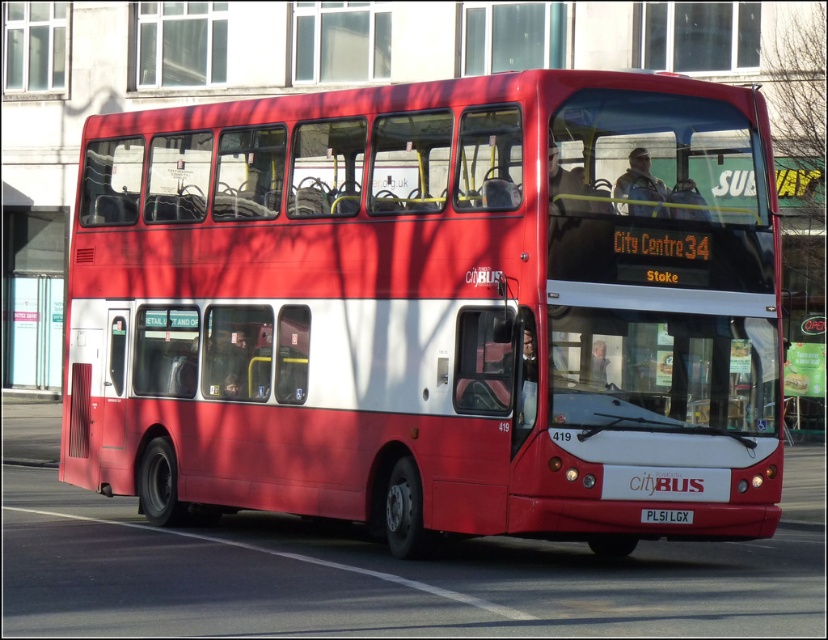
Question: From the image, what is the correct spatial relationship of matte red bus at center in relation to black plastic license plate at bottom center?

Choices:
 (A) left
 (B) right

Answer: (A)

Question: Where is matte red bus at center located in relation to black plastic license plate at bottom center in the image?

Choices:
 (A) above
 (B) below

Answer: (A)

Question: Among these objects, which one is nearest to the camera?

Choices:
 (A) matte red bus at center
 (B) black plastic license plate at bottom center

Answer: (A)

Question: Which object appears closest to the camera in this image?

Choices:
 (A) black plastic license plate at bottom center
 (B) matte red bus at center

Answer: (B)

Question: Does matte red bus at center lie in front of black plastic license plate at bottom center?

Choices:
 (A) no
 (B) yes

Answer: (B)